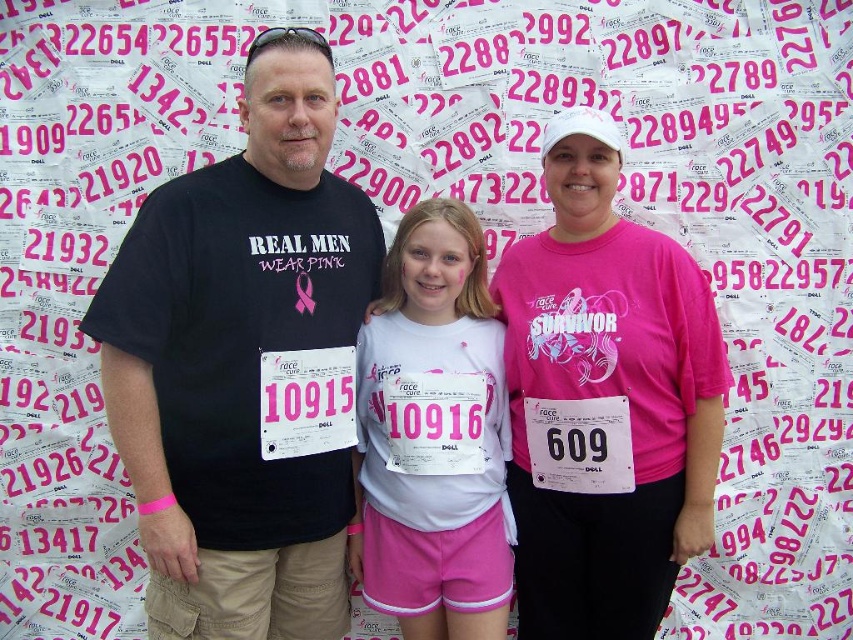
Between black matte t-shirt at center and white fabric shirt at center, which one appears on the left side from the viewer's perspective?

black matte t-shirt at center

Who is shorter, black matte t-shirt at center or white fabric shirt at center?

white fabric shirt at center is shorter.

Image resolution: width=853 pixels, height=640 pixels. I want to click on black matte t-shirt at center, so click(239, 362).

Find the location of a particular element. The height and width of the screenshot is (640, 853). black matte t-shirt at center is located at coordinates (239, 362).

Who is lower down, matte black t-shirt at center or white fabric shirt at center?

Positioned lower is matte black t-shirt at center.

Consider the image. Which is more to the left, matte black t-shirt at center or white fabric shirt at center?

matte black t-shirt at center

Measure the distance between matte black t-shirt at center and camera.

matte black t-shirt at center is 8.38 meters away from camera.

Locate an element on the screen. This screenshot has width=853, height=640. matte black t-shirt at center is located at coordinates (241, 362).

Is matte black t-shirt at center taller than black matte t-shirt at center?

No, matte black t-shirt at center is not taller than black matte t-shirt at center.

What do you see at coordinates (241, 362) in the screenshot? I see `matte black t-shirt at center` at bounding box center [241, 362].

Does point (225, 186) come in front of point (316, 262)?

Yes, it is in front of point (316, 262).

Where is `matte black t-shirt at center`? The image size is (853, 640). matte black t-shirt at center is located at coordinates coord(241,362).